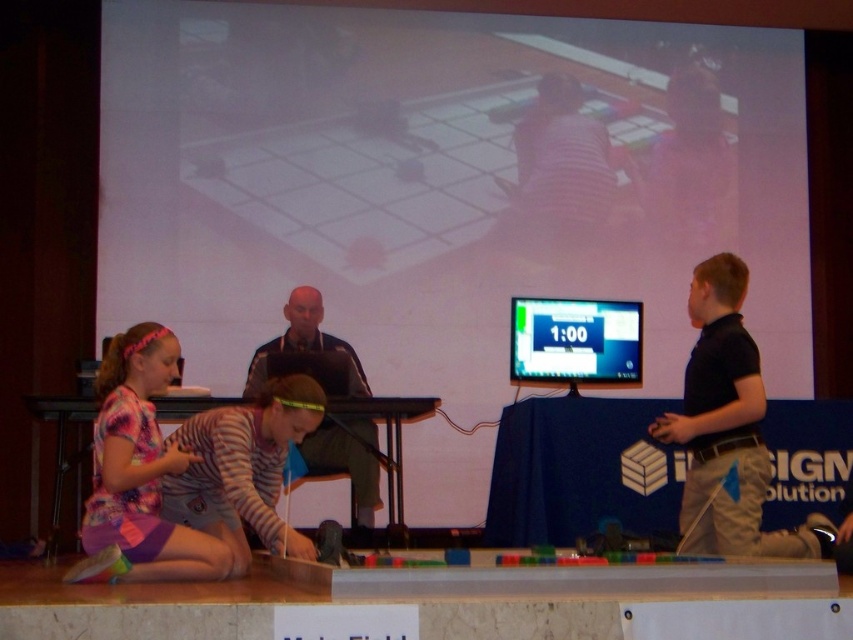
Is white matte projection screen at upper center thinner than black cotton shirt at right?

Incorrect, white matte projection screen at upper center's width is not less than black cotton shirt at right's.

Is white matte projection screen at upper center bigger than black cotton shirt at right?

Yes, white matte projection screen at upper center is bigger than black cotton shirt at right.

Does point (671, 362) come in front of point (759, 534)?

No, it is behind (759, 534).

At what (x,y) coordinates should I click in order to perform the action: click on white matte projection screen at upper center. Please return your answer as a coordinate pair (x, y). The height and width of the screenshot is (640, 853). Looking at the image, I should click on (444, 180).

Who is shorter, white matte projection screen at upper center or dark gray shirt at center?

dark gray shirt at center

Does white matte projection screen at upper center have a larger size compared to dark gray shirt at center?

Indeed, white matte projection screen at upper center has a larger size compared to dark gray shirt at center.

You are a GUI agent. You are given a task and a screenshot of the screen. Output one action in this format:
    pyautogui.click(x=<x>, y=<y>)
    Task: Click on the white matte projection screen at upper center
    The width and height of the screenshot is (853, 640).
    Given the screenshot: What is the action you would take?
    pyautogui.click(x=444, y=180)

Which is below, black cotton shirt at right or printed cotton shirt at lower left?

printed cotton shirt at lower left is below.

Between point (737, 396) and point (138, 410), which one is positioned behind?

Positioned behind is point (737, 396).

Is point (679, 547) positioned after point (157, 476)?

Yes, point (679, 547) is farther from viewer.

Where is `black cotton shirt at right`? This screenshot has height=640, width=853. black cotton shirt at right is located at coordinates (727, 429).